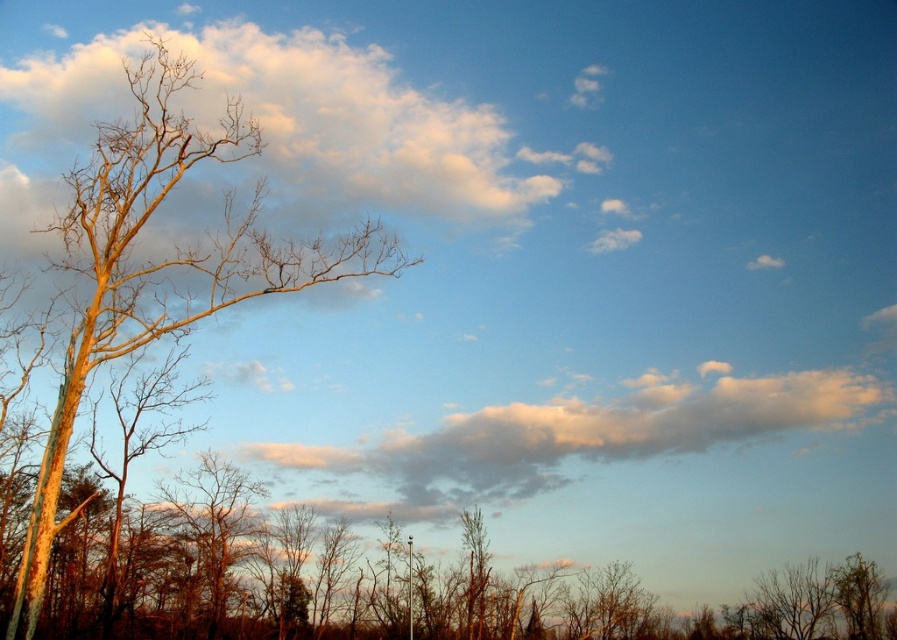
Question: Which point appears farthest from the camera in this image?

Choices:
 (A) (190, 260)
 (B) (364, 131)

Answer: (B)

Question: From the image, what is the correct spatial relationship of cloudy sky at upper left in relation to smooth brown tree at left?

Choices:
 (A) right
 (B) left

Answer: (A)

Question: Which object appears farthest from the camera in this image?

Choices:
 (A) smooth brown tree at left
 (B) white fluffy cloud at upper center
 (C) cloudy sky at upper left

Answer: (B)

Question: Which of the following is the farthest from the observer?

Choices:
 (A) (306, 166)
 (B) (318, 268)

Answer: (A)

Question: Does smooth brown tree at left appear over white fluffy cloud at upper center?

Choices:
 (A) no
 (B) yes

Answer: (B)

Question: Is smooth brown tree at left wider than white fluffy cloud at upper center?

Choices:
 (A) yes
 (B) no

Answer: (B)